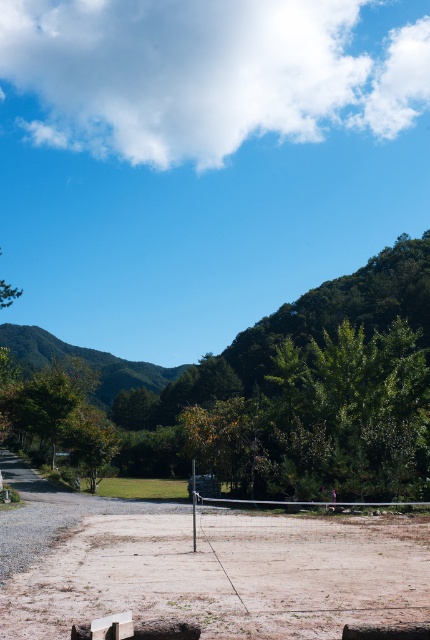
You are standing at the edge of the dirt volleyball court and want to walk directly towards the green leafy tree at center and the brown sandy dirt field at center. Which one will you encounter first?

You will encounter the green leafy tree at center first because it is closer to you than the brown sandy dirt field at center, which is further away.

You are planning to set up a picnic blanket in the brown sandy dirt field at center. There is a green leafy tree at center that you want to use for shade. How far apart are the picnic blanket and the tree?

The green leafy tree at center and brown sandy dirt field at center are 152.38 feet apart from each other, so the picnic blanket and the tree are 152.38 feet apart.

You are planning to set up a picnic blanket in the image. Which object, the green leafy tree at center or the brown sandy dirt field at center, would be more suitable for placing the blanket? Please explain your choice based on their sizes.

The green leafy tree at center has a larger size compared to the brown sandy dirt field at center. However, the brown sandy dirt field at center is more suitable for placing the picnic blanket because it is a flat open area, whereas the tree might have limited space under it due to its size and foliage.